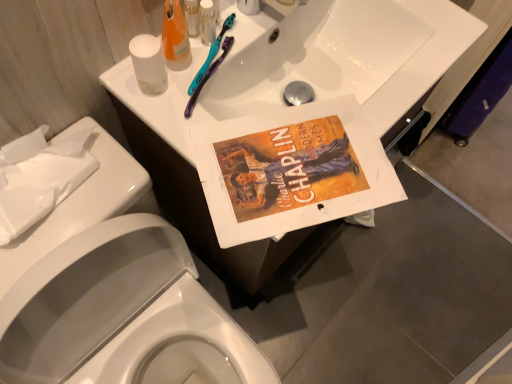
Find the location of `vacant space to the right of translucent orange liquid at upper center`. vacant space to the right of translucent orange liquid at upper center is located at coordinates click(272, 107).